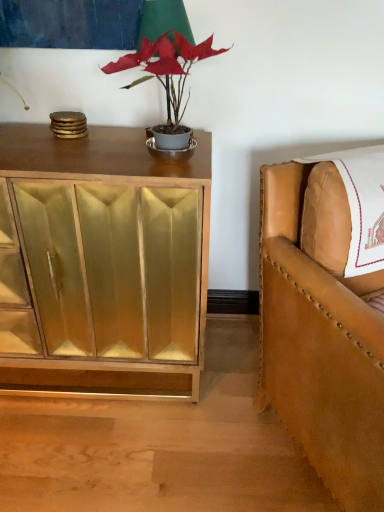
Question: From the image's perspective, is matte gray pot at center over green fabric table lamp at upper center?

Choices:
 (A) no
 (B) yes

Answer: (A)

Question: Is there a large distance between matte gray pot at center and green fabric table lamp at upper center?

Choices:
 (A) yes
 (B) no

Answer: (B)

Question: Considering the relative positions of matte gray pot at center and green fabric table lamp at upper center in the image provided, is matte gray pot at center to the right of green fabric table lamp at upper center from the viewer's perspective?

Choices:
 (A) yes
 (B) no

Answer: (A)

Question: Is matte gray pot at center outside green fabric table lamp at upper center?

Choices:
 (A) yes
 (B) no

Answer: (A)

Question: Is matte gray pot at center oriented towards green fabric table lamp at upper center?

Choices:
 (A) no
 (B) yes

Answer: (B)

Question: Is gold mirrored cabinet at left wider or thinner than green fabric table lamp at upper center?

Choices:
 (A) wide
 (B) thin

Answer: (A)

Question: In the image, is gold mirrored cabinet at left on the left side or the right side of green fabric table lamp at upper center?

Choices:
 (A) left
 (B) right

Answer: (A)

Question: Is gold mirrored cabinet at left bigger or smaller than green fabric table lamp at upper center?

Choices:
 (A) big
 (B) small

Answer: (A)

Question: Is gold mirrored cabinet at left in front of or behind green fabric table lamp at upper center in the image?

Choices:
 (A) front
 (B) behind

Answer: (A)

Question: Is point click(x=147, y=59) positioned closer to the camera than point click(x=119, y=169)?

Choices:
 (A) closer
 (B) farther

Answer: (A)

Question: Considering the relative positions of matte gray pot at center and gold mirrored cabinet at left in the image provided, is matte gray pot at center to the left or to the right of gold mirrored cabinet at left?

Choices:
 (A) right
 (B) left

Answer: (A)

Question: Looking at the image, does matte gray pot at center seem bigger or smaller compared to gold mirrored cabinet at left?

Choices:
 (A) big
 (B) small

Answer: (B)

Question: Considering their positions, is matte gray pot at center located in front of or behind gold mirrored cabinet at left?

Choices:
 (A) front
 (B) behind

Answer: (A)

Question: Considering the positions of matte gray pot at center and tan leather chair at right in the image, is matte gray pot at center taller or shorter than tan leather chair at right?

Choices:
 (A) tall
 (B) short

Answer: (B)

Question: Relative to tan leather chair at right, is matte gray pot at center in front or behind?

Choices:
 (A) behind
 (B) front

Answer: (A)